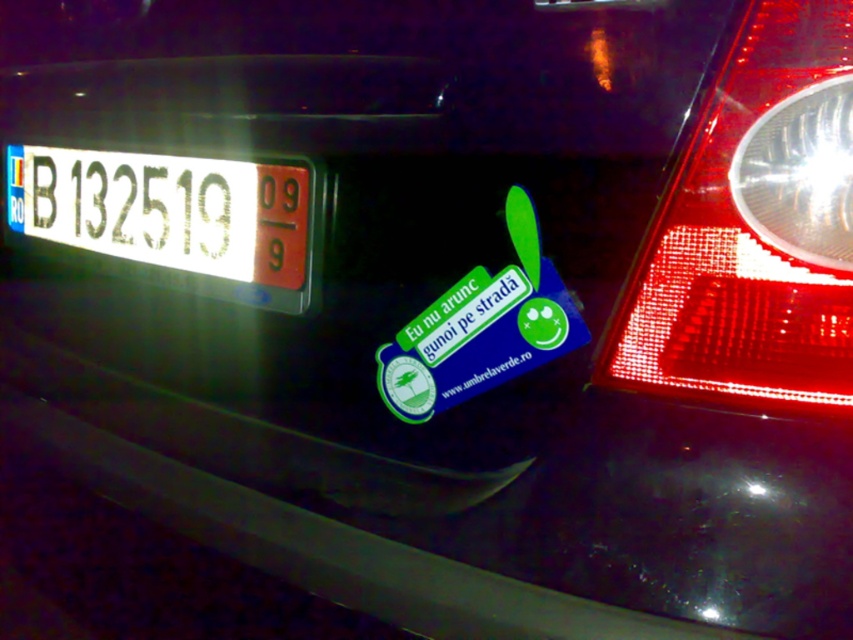
Describe the element at coordinates (166, 211) in the screenshot. This screenshot has height=640, width=853. I see `white plastic license plate at center` at that location.

Can you confirm if white plastic license plate at center is positioned below blue glossy sticker at center?

Incorrect, white plastic license plate at center is not positioned below blue glossy sticker at center.

Does point (38, 232) come farther from viewer compared to point (524, 240)?

Yes, it is.

Locate an element on the screen. The height and width of the screenshot is (640, 853). white plastic license plate at center is located at coordinates (166, 211).

The height and width of the screenshot is (640, 853). I want to click on transparent plastic tail light at right, so pos(753,228).

Is transparent plastic tail light at right positioned in front of blue glossy sticker at center?

Yes, it is.

Image resolution: width=853 pixels, height=640 pixels. I want to click on transparent plastic tail light at right, so [753, 228].

What are the coordinates of `transparent plastic tail light at right` in the screenshot? It's located at (753, 228).

Who is positioned more to the right, transparent plastic tail light at right or white plastic license plate at center?

Positioned to the right is transparent plastic tail light at right.

Does transparent plastic tail light at right have a lesser height compared to white plastic license plate at center?

No.

At what (x,y) coordinates should I click in order to perform the action: click on transparent plastic tail light at right. Please return your answer as a coordinate pair (x, y). Image resolution: width=853 pixels, height=640 pixels. Looking at the image, I should click on (753, 228).

You are a GUI agent. You are given a task and a screenshot of the screen. Output one action in this format:
    pyautogui.click(x=<x>, y=<y>)
    Task: Click on the transparent plastic tail light at right
    Image resolution: width=853 pixels, height=640 pixels.
    Given the screenshot: What is the action you would take?
    pyautogui.click(x=753, y=228)